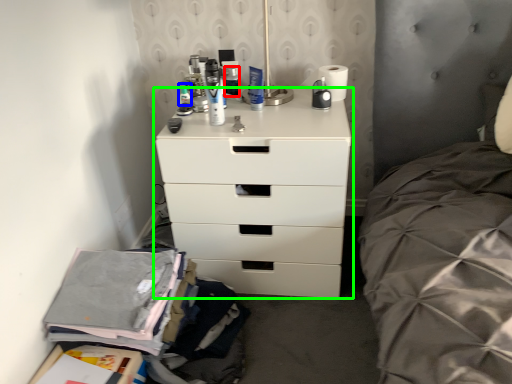
Question: Estimate the real-world distances between objects in this image. Which object is farther from toiletry (highlighted by a red box), toiletry (highlighted by a blue box) or chest of drawers (highlighted by a green box)?

Choices:
 (A) toiletry
 (B) chest of drawers

Answer: (B)